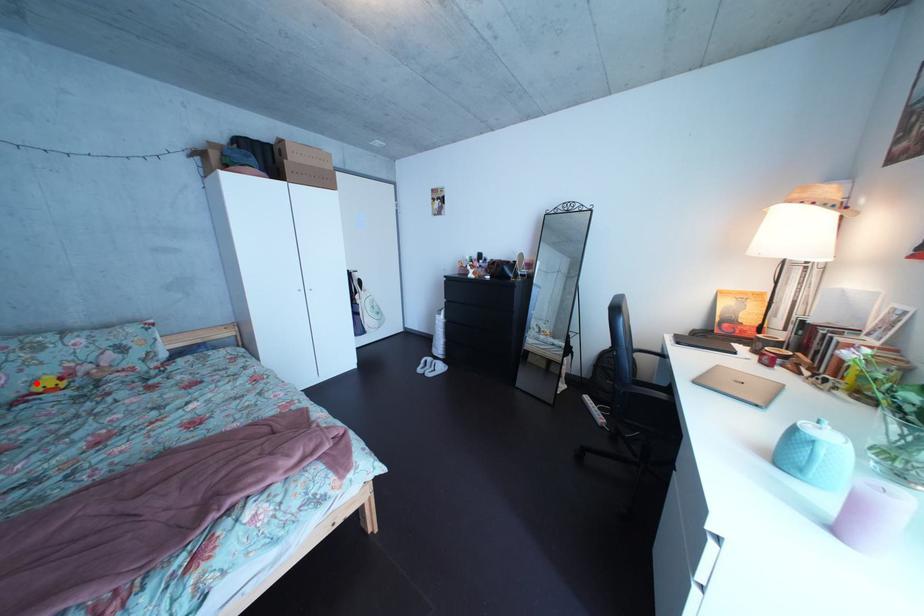
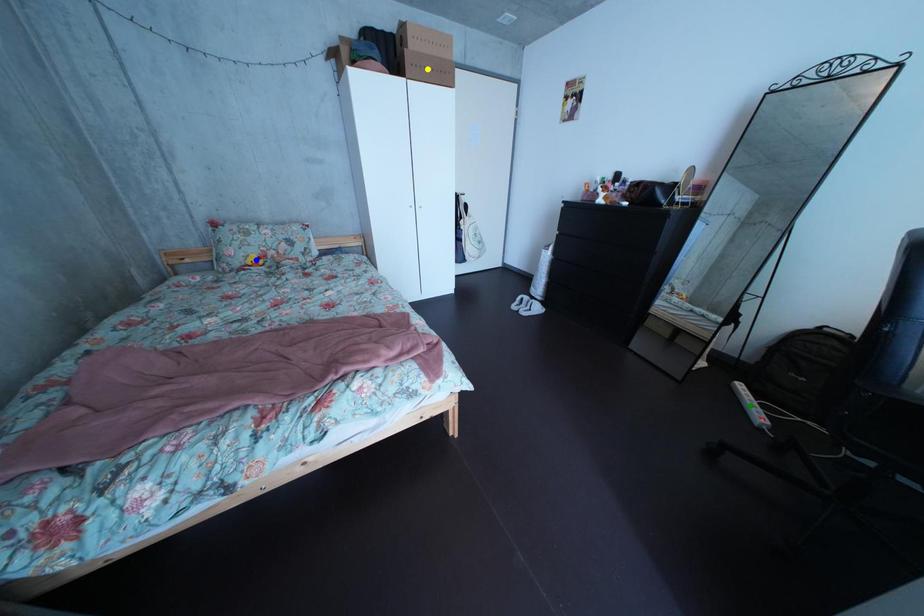
Question: I am providing you with two images of the same scene from different viewpoints. A red point is marked on the first image. You are given multiple points on the second image. Which point in image 2 represents the same 3d spot as the red point in image 1?

Choices:
 (A) blue point
 (B) green point
 (C) yellow point

Answer: (A)